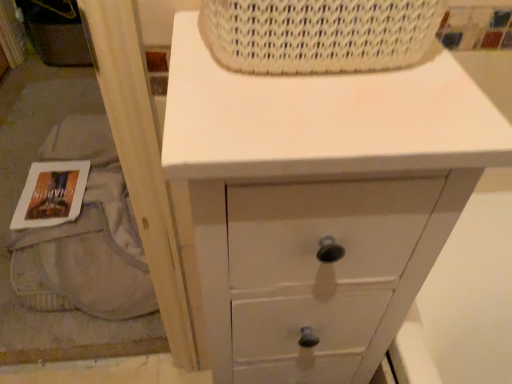
The image size is (512, 384). I want to click on white paper book at lower left, so click(51, 194).

Locate an element on the screen. The width and height of the screenshot is (512, 384). white woven basket at upper center is located at coordinates (319, 34).

Which is more distant, (48,208) or (403,28)?

The point (48,208) is more distant.

From a real-world perspective, is white paper book at lower left physically above white woven basket at upper center?

No.

Is white paper book at lower left situated inside white woven basket at upper center or outside?

The correct answer is: outside.

Which of these two, white paper book at lower left or white woven basket at upper center, is smaller?

white paper book at lower left is smaller.

Find the location of a particular element. This screenshot has height=384, width=512. magazine located underneath the white painted wood chest of drawers at upper center (from a real-world perspective) is located at coordinates (51, 194).

Can you confirm if white paper book at lower left is positioned to the left of white painted wood chest of drawers at upper center?

Yes.

From a real-world perspective, who is located lower, white paper book at lower left or white painted wood chest of drawers at upper center?

white paper book at lower left.

Looking at this image, which point is more distant from viewer, (76, 206) or (354, 343)?

The point (76, 206) is farther.

Between white woven basket at upper center and white painted wood chest of drawers at upper center, which one appears on the right side from the viewer's perspective?

white woven basket at upper center.

Who is bigger, white woven basket at upper center or white painted wood chest of drawers at upper center?

Bigger between the two is white painted wood chest of drawers at upper center.

Who is taller, white woven basket at upper center or white painted wood chest of drawers at upper center?

white painted wood chest of drawers at upper center is taller.

Considering the positions of point (295, 189) and point (401, 6), is point (295, 189) closer or farther from the camera than point (401, 6)?

Point (295, 189) is positioned farther from the camera compared to point (401, 6).

Considering the relative sizes of white painted wood chest of drawers at upper center and white woven basket at upper center in the image provided, is white painted wood chest of drawers at upper center shorter than white woven basket at upper center?

No.

How far apart are white painted wood chest of drawers at upper center and white woven basket at upper center?

They are 7.32 inches apart.

From a real-world perspective, between white painted wood chest of drawers at upper center and white woven basket at upper center, who is vertically higher?

white woven basket at upper center.

Between white woven basket at upper center and white paper book at lower left, which one has smaller width?

white woven basket at upper center.

Which object is positioned more to the left, white woven basket at upper center or white paper book at lower left?

white paper book at lower left is more to the left.

Can you see white woven basket at upper center touching white paper book at lower left?

white woven basket at upper center and white paper book at lower left are clearly separated.

At what (x,y) coordinates should I click in order to perform the action: click on magazine on the left of white woven basket at upper center. Please return your answer as a coordinate pair (x, y). The image size is (512, 384). Looking at the image, I should click on (51, 194).

Locate an element on the screen. This screenshot has width=512, height=384. magazine to the left of white painted wood chest of drawers at upper center is located at coordinates (51, 194).

From the image's perspective, which is below, white painted wood chest of drawers at upper center or white paper book at lower left?

white painted wood chest of drawers at upper center, from the image's perspective.

Is white painted wood chest of drawers at upper center oriented away from white paper book at lower left?

That's not correct — white painted wood chest of drawers at upper center is not looking away from white paper book at lower left.

Identify the location of magazine that appears below the white woven basket at upper center (from the image's perspective). (51, 194).

You are a GUI agent. You are given a task and a screenshot of the screen. Output one action in this format:
    pyautogui.click(x=<x>, y=<y>)
    Task: Click on the magazine located on the left of white painted wood chest of drawers at upper center
    
    Given the screenshot: What is the action you would take?
    pyautogui.click(x=51, y=194)

From the image, which object appears to be nearer to white painted wood chest of drawers at upper center, white woven basket at upper center or white paper book at lower left?

Based on the image, white woven basket at upper center appears to be nearer to white painted wood chest of drawers at upper center.

Which object lies further to the anchor point white woven basket at upper center, white paper book at lower left or white painted wood chest of drawers at upper center?

The object further to white woven basket at upper center is white paper book at lower left.

Consider the image. Considering their positions, is white painted wood chest of drawers at upper center positioned further to white woven basket at upper center than white paper book at lower left?

white paper book at lower left.

Looking at the image, which one is located closer to white paper book at lower left, white painted wood chest of drawers at upper center or white woven basket at upper center?

white painted wood chest of drawers at upper center.

Considering their positions, is white paper book at lower left positioned closer to white painted wood chest of drawers at upper center than white woven basket at upper center?

white woven basket at upper center is positioned closer to the anchor white painted wood chest of drawers at upper center.

Which object lies nearer to the anchor point white paper book at lower left, white woven basket at upper center or white painted wood chest of drawers at upper center?

Based on the image, white painted wood chest of drawers at upper center appears to be nearer to white paper book at lower left.

Find the location of `chest of drawers between white woven basket at upper center and white paper book at lower left from front to back`. chest of drawers between white woven basket at upper center and white paper book at lower left from front to back is located at coordinates (316, 203).